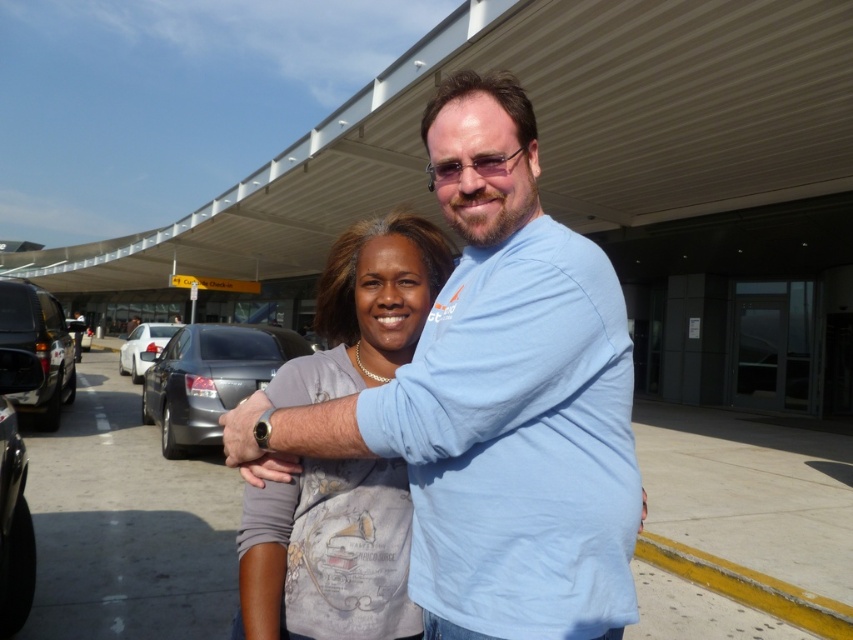
Question: Which point is farther from the camera taking this photo?

Choices:
 (A) (154, 344)
 (B) (200, 342)
 (C) (0, 492)
 (D) (383, 499)

Answer: (A)

Question: Can you confirm if matte gray shirt at center is bigger than shiny black car at left?

Choices:
 (A) yes
 (B) no

Answer: (B)

Question: Estimate the real-world distances between objects in this image. Which object is closer to the light blue shirt at center?

Choices:
 (A) white glossy sedan at center
 (B) matte gray shirt at center

Answer: (B)

Question: Can you confirm if matte black suv at left is positioned to the left of white glossy sedan at center?

Choices:
 (A) no
 (B) yes

Answer: (A)

Question: Which object is closer to the camera taking this photo?

Choices:
 (A) matte gray shirt at center
 (B) shiny black car at left
 (C) gray metallic sedan at center
 (D) light blue shirt at center

Answer: (D)

Question: Does light blue shirt at center come in front of shiny black car at left?

Choices:
 (A) yes
 (B) no

Answer: (A)